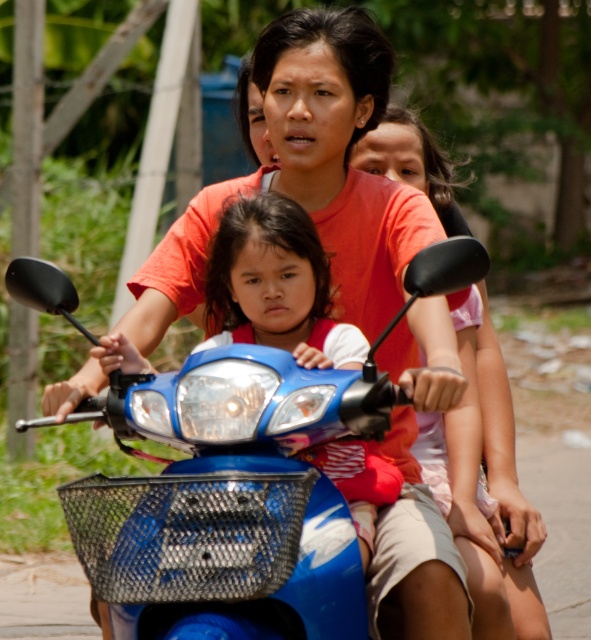
Which is more to the right, blue glossy motorcycle at center or matte blue scooter at center?

matte blue scooter at center is more to the right.

Who is more distant from viewer, (294, 592) or (306, 340)?

The point (306, 340) is more distant.

At what (x,y) coordinates should I click in order to perform the action: click on blue glossy motorcycle at center. Please return your answer as a coordinate pair (x, y). Looking at the image, I should click on (238, 483).

Does pink fabric shirt at center appear on the left side of matte blue scooter at center?

In fact, pink fabric shirt at center is to the right of matte blue scooter at center.

Can you confirm if pink fabric shirt at center is positioned above matte blue scooter at center?

No.

At what (x,y) coordinates should I click in order to perform the action: click on pink fabric shirt at center. Please return your answer as a coordinate pair (x, y). The image size is (591, 640). Looking at the image, I should click on (488, 483).

Locate an element on the screen. pink fabric shirt at center is located at coordinates (488, 483).

Does point (433, 259) come in front of point (444, 209)?

Yes, it is in front of point (444, 209).

Based on the photo, which is more to the right, blue glossy motorcycle at center or pink fabric shirt at center?

→ From the viewer's perspective, pink fabric shirt at center appears more on the right side.

I want to click on blue glossy motorcycle at center, so click(x=238, y=483).